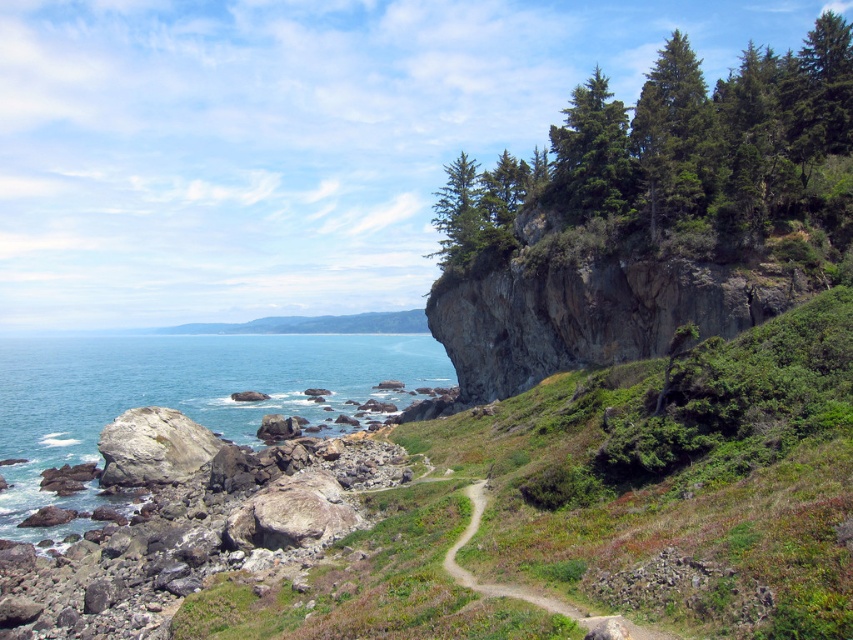
Question: Does green textured pine at upper right come in front of smooth gray rock at lower left?

Choices:
 (A) no
 (B) yes

Answer: (A)

Question: Which object is closer to the camera taking this photo?

Choices:
 (A) white rock at lower left
 (B) green textured pine at upper right
 (C) smooth gray rock at lower left
 (D) blue water at lower left

Answer: (C)

Question: Does blue water at lower left have a lesser width compared to white rock at lower left?

Choices:
 (A) no
 (B) yes

Answer: (A)

Question: Which point is closer to the camera?

Choices:
 (A) smooth gray rock at lower left
 (B) blue water at lower left
 (C) white rock at lower left
 (D) green textured pine at upper right

Answer: (A)

Question: Does smooth gray rock at lower left have a lesser width compared to blue water at lower left?

Choices:
 (A) yes
 (B) no

Answer: (A)

Question: Which object appears closest to the camera in this image?

Choices:
 (A) blue water at lower left
 (B) white rock at lower left
 (C) smooth gray rock at lower left

Answer: (C)